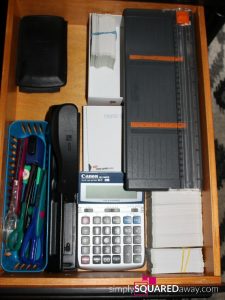
Identify the location of bin. The width and height of the screenshot is (225, 300). (25, 135).